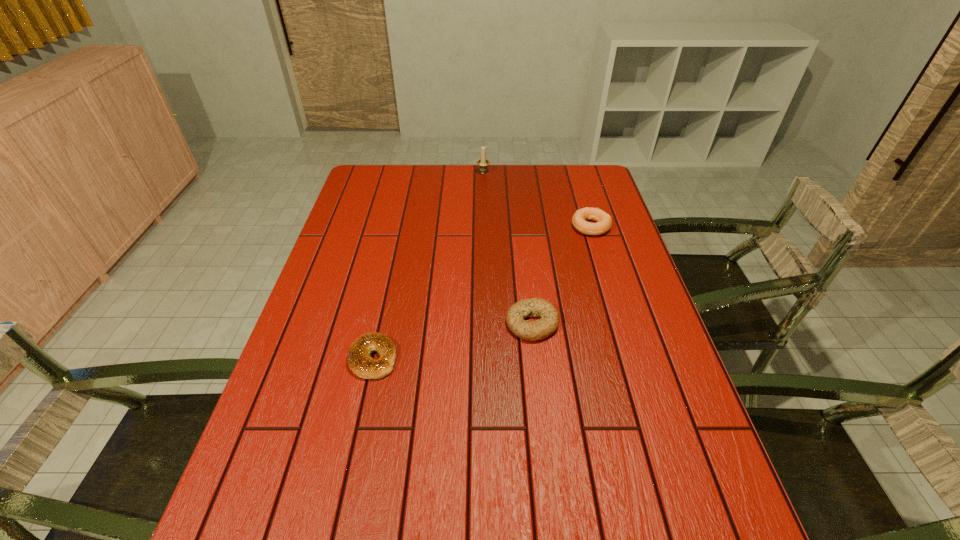
The image size is (960, 540). I want to click on the tallest object, so click(482, 163).

Find the location of a particular element. the farthest object is located at coordinates (482, 163).

Locate an element on the screen. the rightmost object is located at coordinates (604, 221).

The image size is (960, 540). I want to click on the rightmost bagel, so click(x=604, y=221).

Find the location of a particular element. The width and height of the screenshot is (960, 540). the second bagel from left to right is located at coordinates (540, 329).

The width and height of the screenshot is (960, 540). Find the location of `the leftmost object`. the leftmost object is located at coordinates coord(359,361).

I want to click on free space located on the back of the second farthest object, so click(572, 164).

This screenshot has height=540, width=960. What are the coordinates of `vacant space located on the back of the second bagel from left to right` in the screenshot? It's located at (527, 275).

The width and height of the screenshot is (960, 540). What are the coordinates of `vacant area located 0.250m on the back of the leftmost bagel` in the screenshot? It's located at (392, 271).

Find the location of `object located at the far edge`. object located at the far edge is located at coordinates (482, 163).